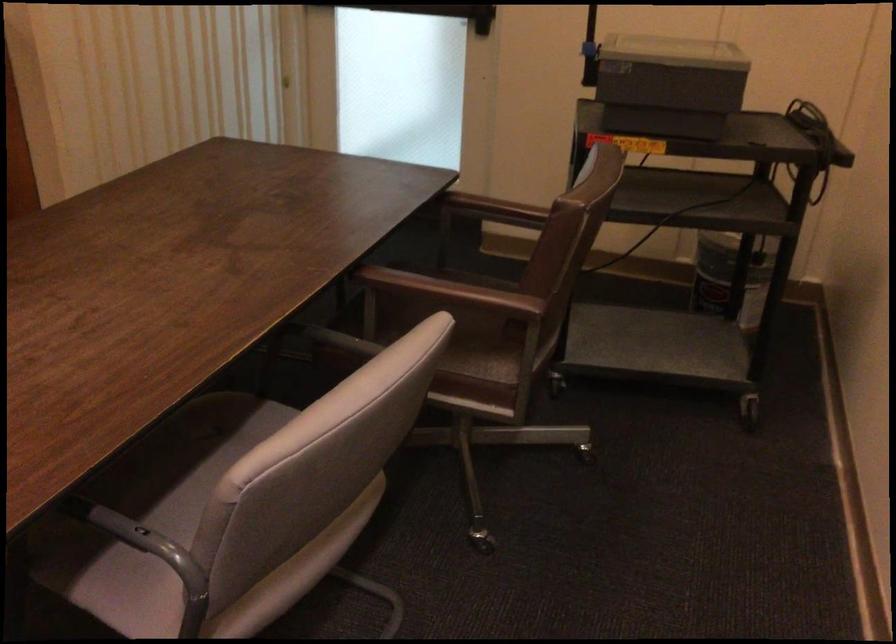
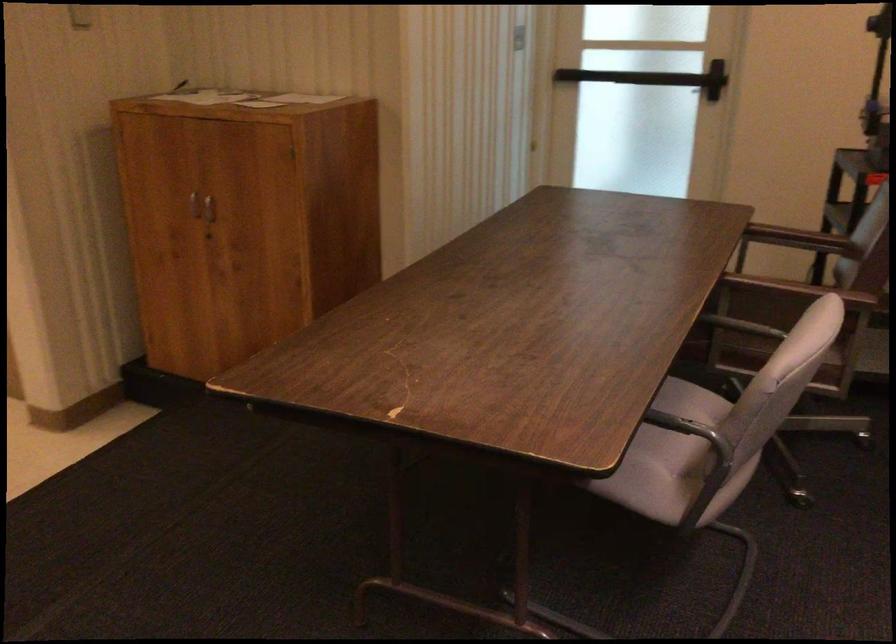
Looking at this image, what movement of the cameraman would produce the second image?

The movement direction of the cameraman is left, backward.